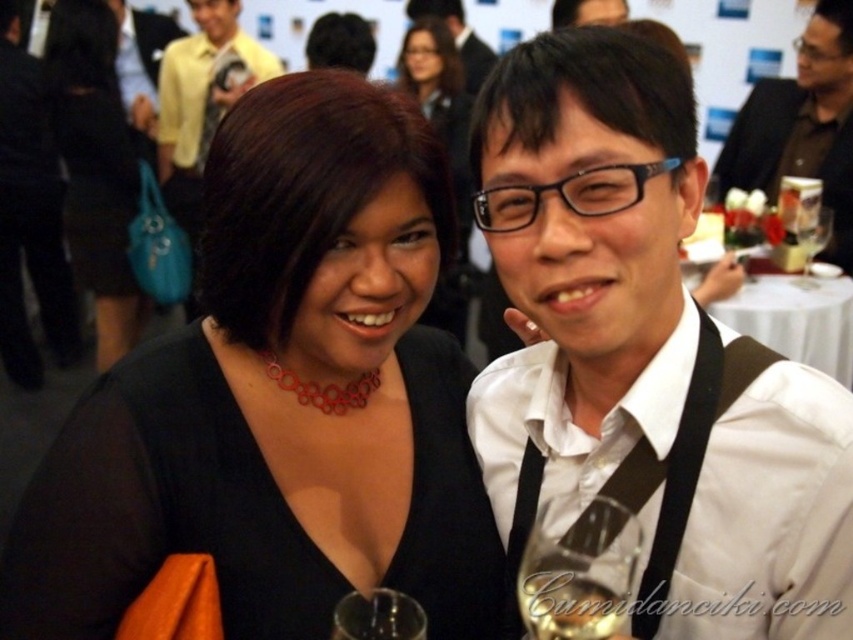
Question: Estimate the real-world distances between objects in this image. Which object is closer to the matte black dress at center?

Choices:
 (A) matte black hair at upper center
 (B) translucent glass wine at center

Answer: (A)

Question: Which point is farther to the camera?

Choices:
 (A) (465, 108)
 (B) (96, 230)
 (C) (821, 214)

Answer: (B)

Question: Is translucent glass wine at center smaller than matte black hair at upper center?

Choices:
 (A) no
 (B) yes

Answer: (B)

Question: Which object is farther from the camera taking this photo?

Choices:
 (A) translucent glass wine at center
 (B) brown leather jacket at upper right

Answer: (B)

Question: Does black fabric dress at center appear on the right side of clear glass wine glass at center?

Choices:
 (A) no
 (B) yes

Answer: (A)

Question: Is white matte shirt at center below translucent glass wine at center?

Choices:
 (A) no
 (B) yes

Answer: (A)